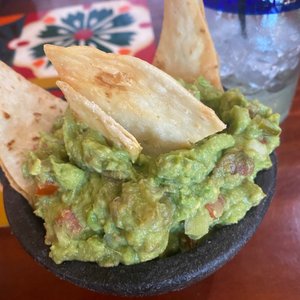
Find the location of `plate`. plate is located at coordinates click(x=203, y=257).